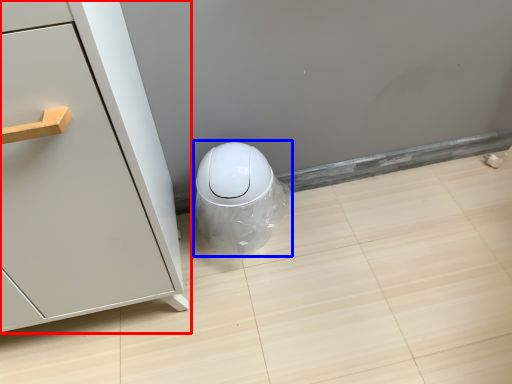
Question: Which object is closer to the camera taking this photo, furniture (highlighted by a red box) or porcelain (highlighted by a blue box)?

Choices:
 (A) furniture
 (B) porcelain

Answer: (A)